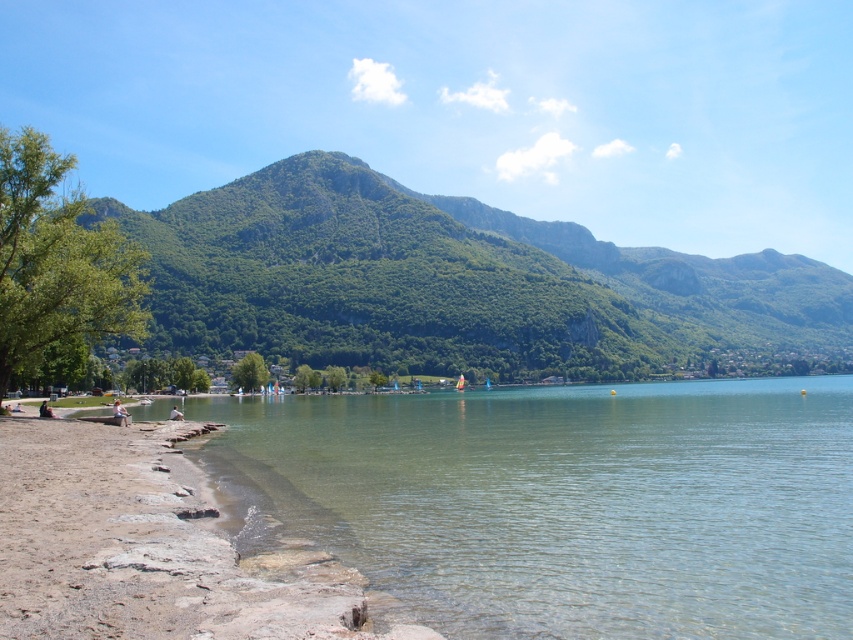
Between clear water at shore left and green leafy mountain at center, which one has less height?

Standing shorter between the two is clear water at shore left.

Does point (544, 550) come in front of point (534, 308)?

Yes, point (544, 550) is in front of point (534, 308).

Image resolution: width=853 pixels, height=640 pixels. Identify the location of clear water at shore left. (564, 502).